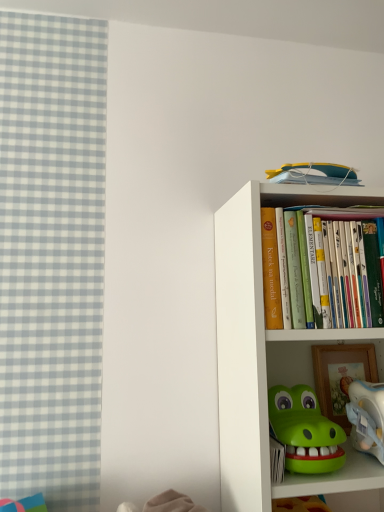
Question: Is point (370, 443) positioned closer to the camera than point (306, 376)?

Choices:
 (A) farther
 (B) closer

Answer: (B)

Question: Considering the positions of plastic white toy at lower right and white matte bookcase at right in the image, is plastic white toy at lower right bigger or smaller than white matte bookcase at right?

Choices:
 (A) big
 (B) small

Answer: (B)

Question: From the image's perspective, is plastic white toy at lower right positioned above or below white matte bookcase at right?

Choices:
 (A) below
 (B) above

Answer: (A)

Question: Considering the positions of white matte bookcase at right and plastic white toy at lower right in the image, is white matte bookcase at right bigger or smaller than plastic white toy at lower right?

Choices:
 (A) big
 (B) small

Answer: (A)

Question: From a real-world perspective, is white matte bookcase at right positioned above or below plastic white toy at lower right?

Choices:
 (A) above
 (B) below

Answer: (A)

Question: Is white matte bookcase at right to the left or to the right of plastic white toy at lower right in the image?

Choices:
 (A) left
 (B) right

Answer: (A)

Question: Would you say white matte bookcase at right is inside or outside plastic white toy at lower right?

Choices:
 (A) inside
 (B) outside

Answer: (B)